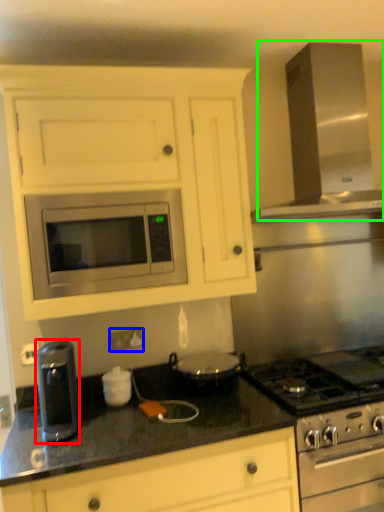
Question: Which is nearer to the kitchen appliance (highlighted by a red box)? electric outlet (highlighted by a blue box) or exhaust hood (highlighted by a green box).

Choices:
 (A) electric outlet
 (B) exhaust hood

Answer: (A)